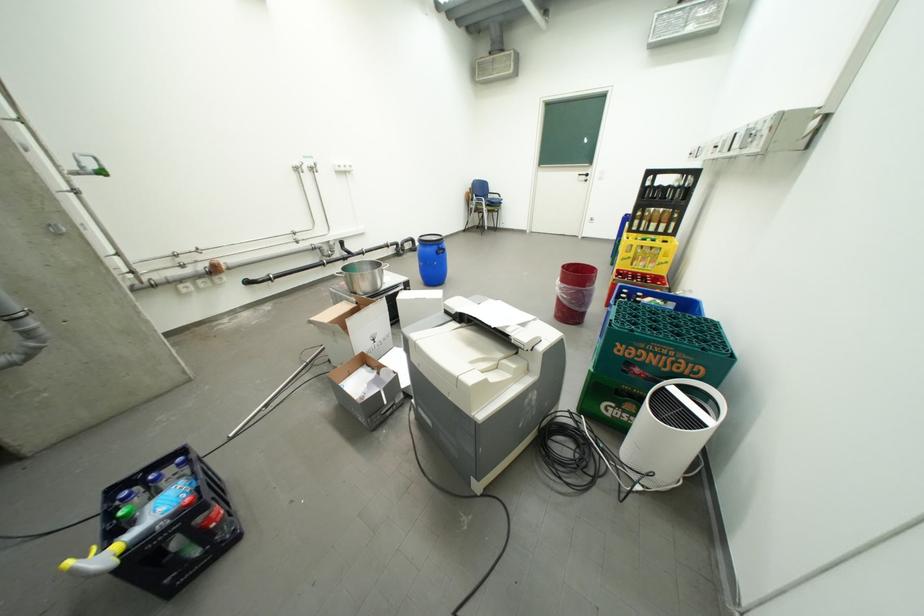
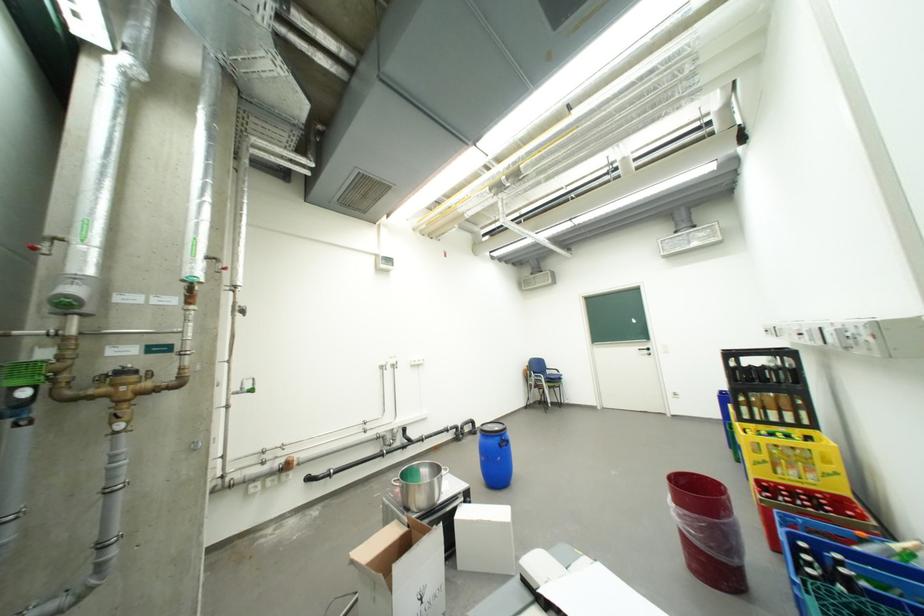
The point at (444, 246) is marked in the first image. Where is the corresponding point in the second image?

(507, 438)